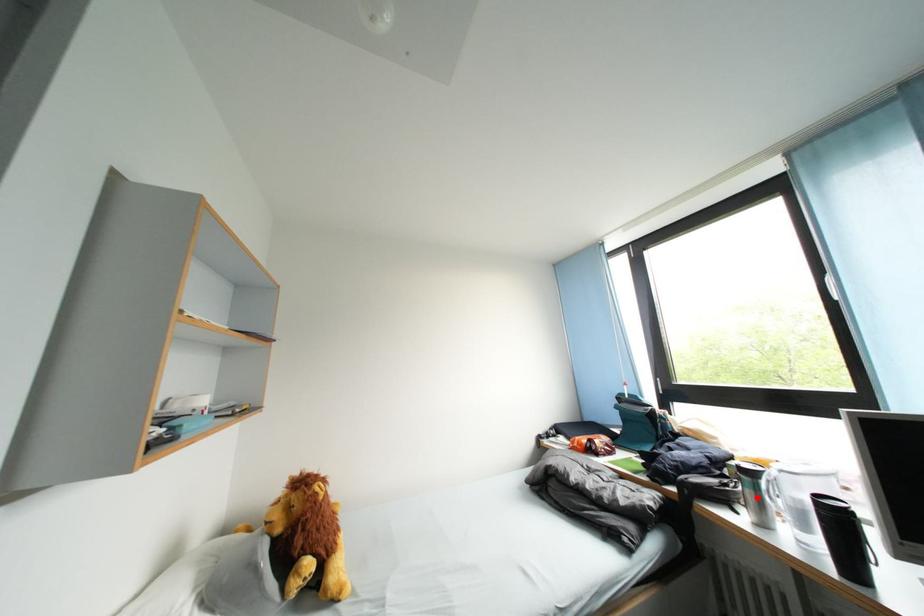
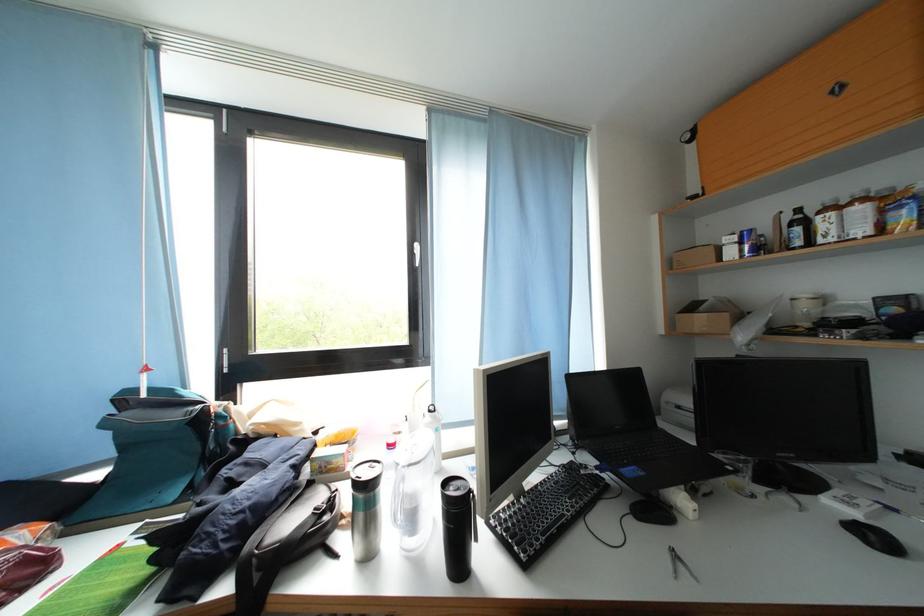
Question: A red point is marked in image1. In image2, is the corresponding 3D point closer to the camera or farther? Reply with the corresponding letter.

Choices:
 (A) The corresponding 3D point is closer.
 (B) The corresponding 3D point is farther.

Answer: (B)